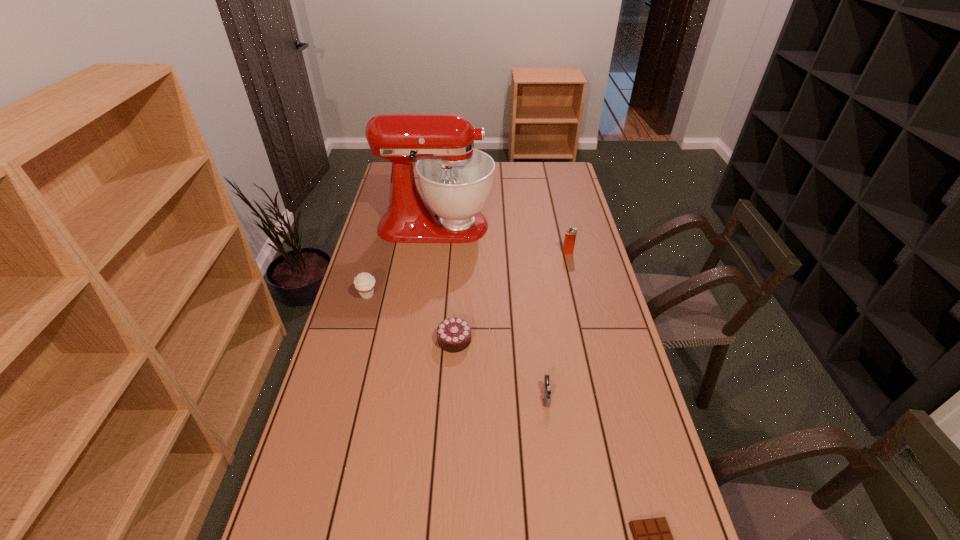
I want to click on free location located 0.140m on the back of the fifth nearest object, so click(563, 230).

In order to click on vacant space located 0.090m on the front of the third farthest object in this screenshot , I will do `click(361, 321)`.

Locate an element on the screen. This screenshot has width=960, height=540. free space located 0.140m on the back of the shorter igniter is located at coordinates (540, 346).

Identify the location of free location located 0.240m on the right of the second shortest object. The image size is (960, 540). (546, 340).

Identify the location of mixer present at the left edge. (455, 179).

Locate an element on the screen. muffin that is at the left edge is located at coordinates (364, 283).

Find the location of a particular element. Image resolution: width=960 pixels, height=540 pixels. object situated at the right edge is located at coordinates (570, 235).

Where is `free location at the left edge`? free location at the left edge is located at coordinates (329, 430).

Where is `vacant space at the right edge of the desktop`? Image resolution: width=960 pixels, height=540 pixels. vacant space at the right edge of the desktop is located at coordinates (580, 204).

You are a GUI agent. You are given a task and a screenshot of the screen. Output one action in this format:
    pyautogui.click(x=<x>, y=<y>)
    Task: Click on the vacant space at the far left corner of the desktop
    Image resolution: width=960 pixels, height=540 pixels.
    Given the screenshot: What is the action you would take?
    pyautogui.click(x=390, y=179)